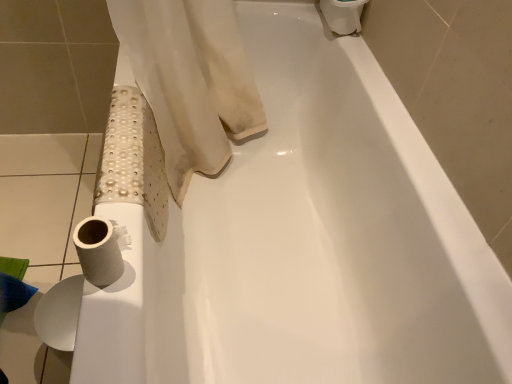
Identify the location of free location to the left of white matte toilet paper at upper right, arranged as the 3th toilet paper when ordered from the bottom. (294, 23).